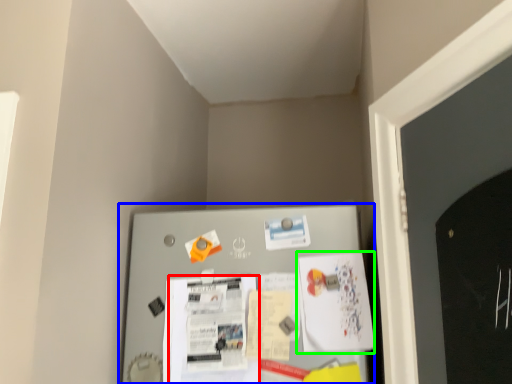
Question: Considering the real-world distances, which object is closest to poster (highlighted by a red box)? bulletin board (highlighted by a blue box) or poster (highlighted by a green box).

Choices:
 (A) bulletin board
 (B) poster

Answer: (A)